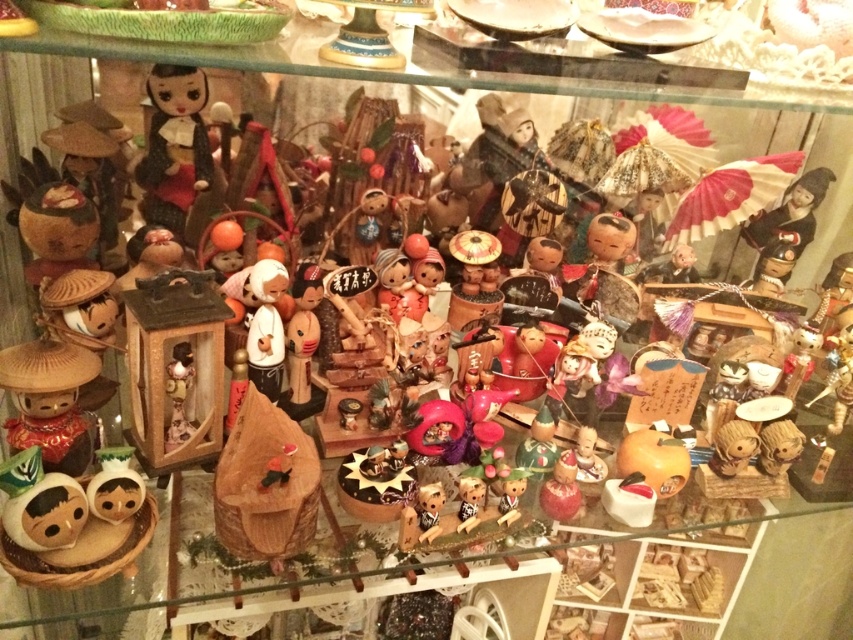
Looking at this image, measure the distance between matte brown figurine at left and camera.

matte brown figurine at left and camera are 28.41 inches apart from each other.

Is matte brown figurine at left closer to the viewer compared to shiny red lacquer bottle at center?

That is True.

Identify the location of matte brown figurine at left. The height and width of the screenshot is (640, 853). (49, 401).